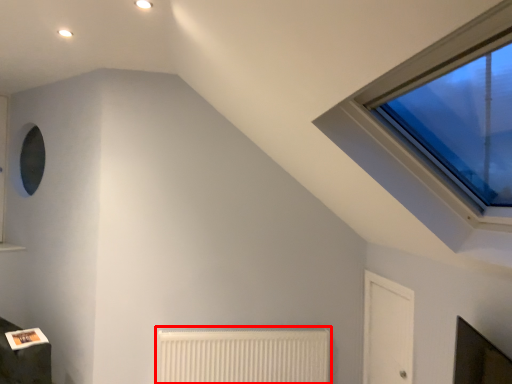
Question: Where is radiator (annotated by the red box) located in relation to glass door in the image?

Choices:
 (A) left
 (B) right

Answer: (A)